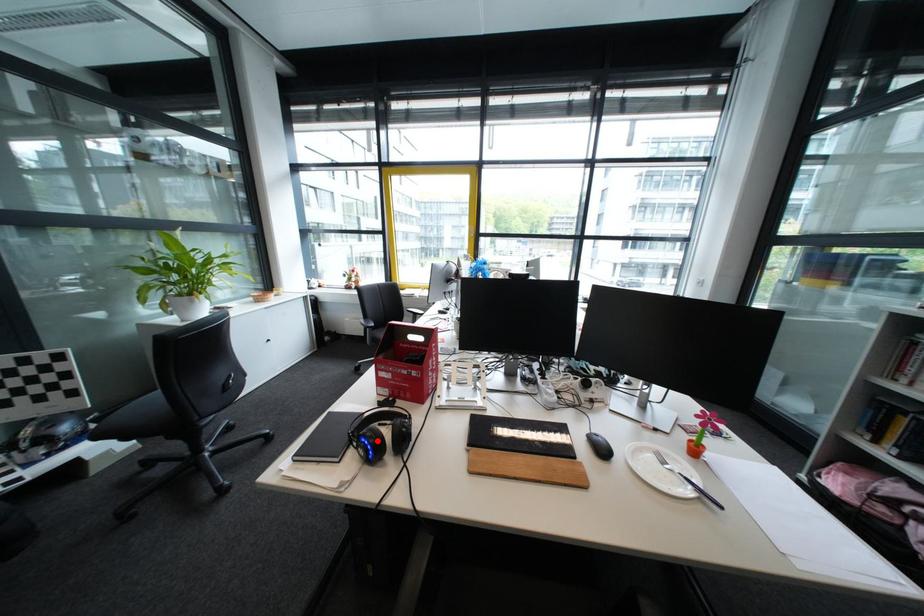
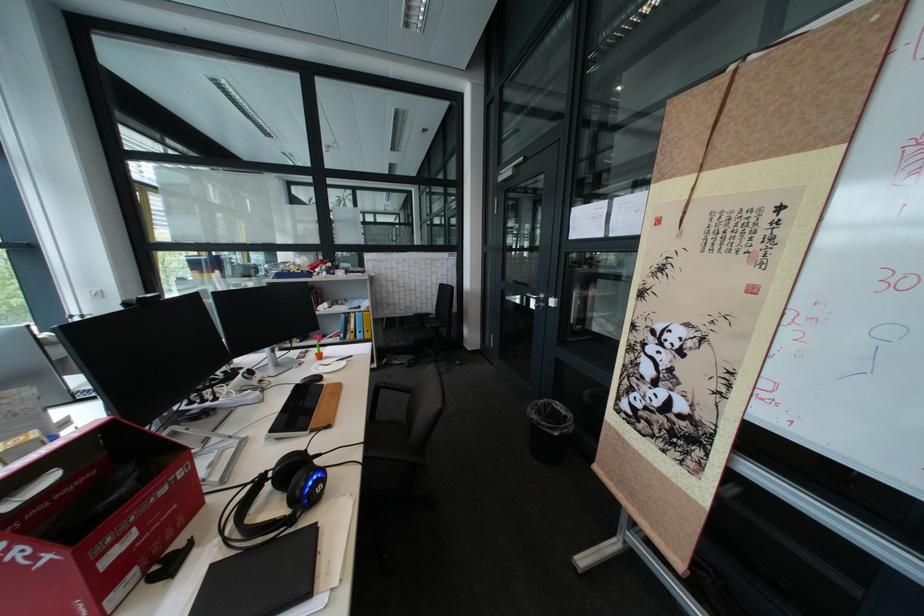
In the second image, find the point that corresponds to the highlighted location in the first image.

(323, 485)